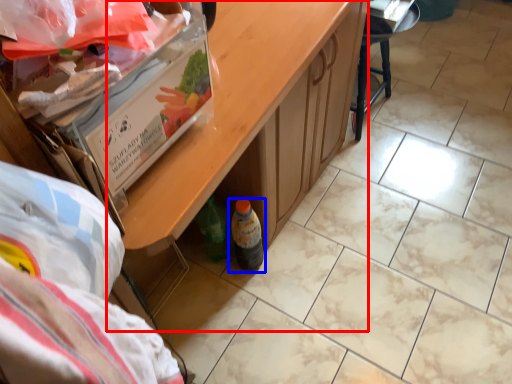
Question: Which object appears farthest to the camera in this image, table (highlighted by a red box) or bottle (highlighted by a blue box)?

Choices:
 (A) table
 (B) bottle

Answer: (B)